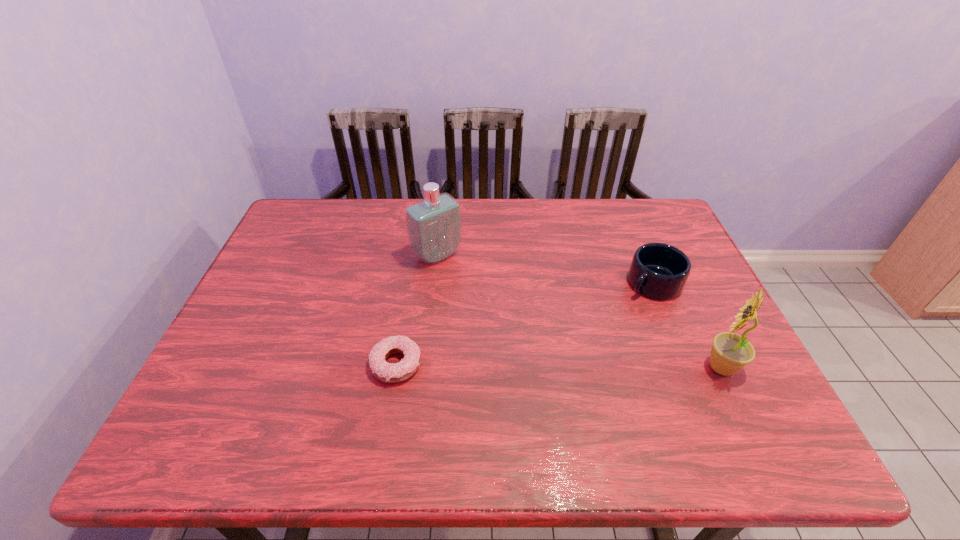
Identify the location of free space between the perfume and the sunflower. (579, 312).

What are the coordinates of `empty location between the perfume and the sunflower` in the screenshot? It's located at (579, 312).

This screenshot has width=960, height=540. What are the coordinates of `free space between the sunflower and the perfume` in the screenshot? It's located at (579, 312).

Locate an element on the screen. The width and height of the screenshot is (960, 540). vacant space that's between the sunflower and the shortest object is located at coordinates (559, 366).

At what (x,y) coordinates should I click in order to perform the action: click on empty space between the sunflower and the perfume. Please return your answer as a coordinate pair (x, y). This screenshot has width=960, height=540. Looking at the image, I should click on (579, 312).

At what (x,y) coordinates should I click in order to perform the action: click on the closest object to the third tallest object. Please return your answer as a coordinate pair (x, y). This screenshot has width=960, height=540. Looking at the image, I should click on (730, 352).

You are a GUI agent. You are given a task and a screenshot of the screen. Output one action in this format:
    pyautogui.click(x=<x>, y=<y>)
    Task: Click on the object that is the second closest to the shortest object
    This screenshot has width=960, height=540.
    Given the screenshot: What is the action you would take?
    pyautogui.click(x=660, y=271)

In order to click on vacant space that satisfies the following two spatial constraints: 1. on the front side of the mug; 2. on the left side of the perfume in this screenshot , I will do `click(434, 282)`.

I want to click on blank space that satisfies the following two spatial constraints: 1. on the front side of the shortest object; 2. on the face of the sunflower, so click(x=396, y=367).

The height and width of the screenshot is (540, 960). I want to click on free location that satisfies the following two spatial constraints: 1. on the back side of the doughnut; 2. on the right side of the perfume, so click(x=414, y=255).